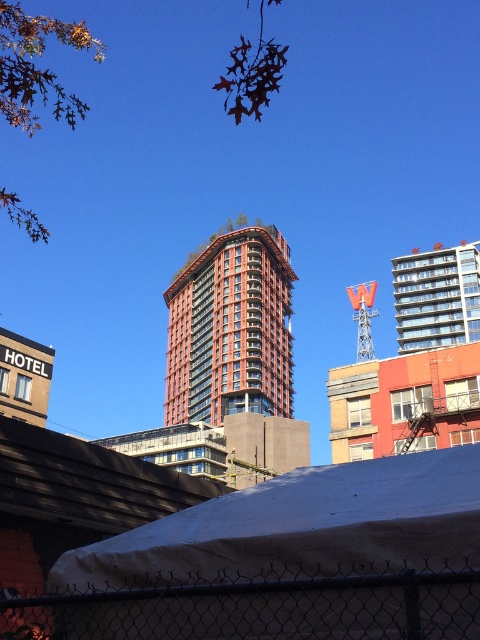
Question: Does red brick building at center appear under glassy teal building at upper center?

Choices:
 (A) no
 (B) yes

Answer: (B)

Question: From the image, what is the correct spatial relationship of red brick building at center in relation to glassy teal building at upper center?

Choices:
 (A) left
 (B) right

Answer: (A)

Question: Among these points, which one is nearest to the camera?

Choices:
 (A) (410, 342)
 (B) (29, 609)
 (C) (200, 323)

Answer: (B)

Question: Which object is closer to the camera taking this photo?

Choices:
 (A) chain link fence at lower center
 (B) glassy teal building at upper center

Answer: (A)

Question: Is red brick building at center below glassy teal building at upper center?

Choices:
 (A) no
 (B) yes

Answer: (B)

Question: Estimate the real-world distances between objects in this image. Which object is closer to the chain link fence at lower center?

Choices:
 (A) glassy teal building at upper center
 (B) red brick building at center

Answer: (A)